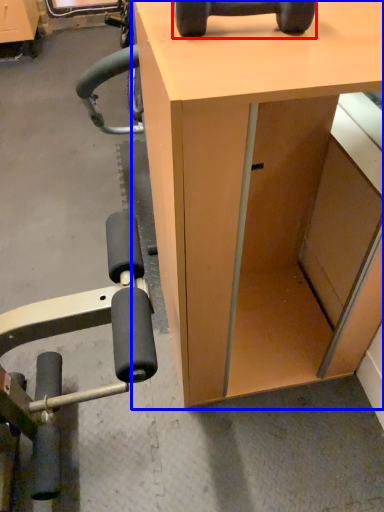
Question: Which object appears farthest to the camera in this image, dumbbell (highlighted by a red box) or desk (highlighted by a blue box)?

Choices:
 (A) dumbbell
 (B) desk

Answer: (A)